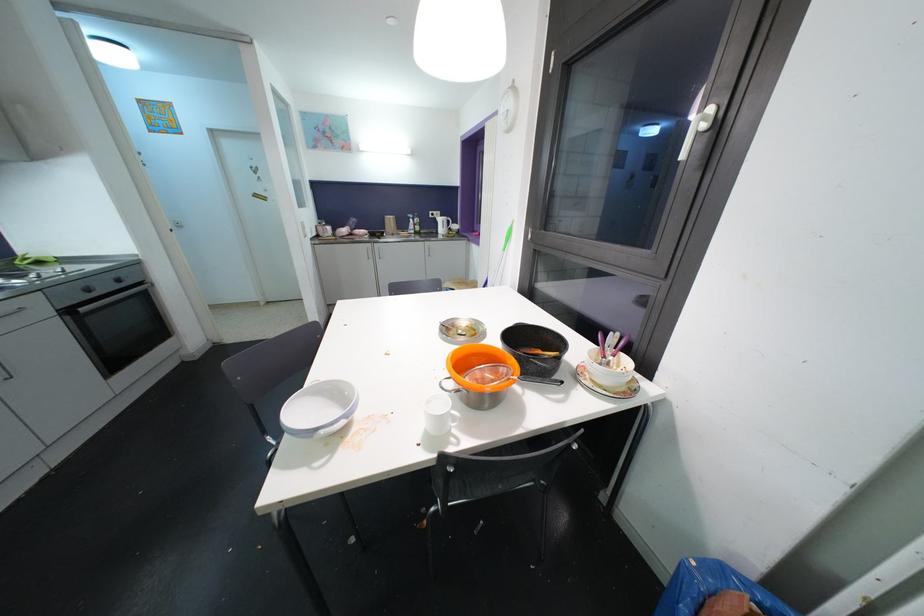
Find where to lift the black pot handle. Please return your answer as a coordinate pair (x, y).

(548, 355)